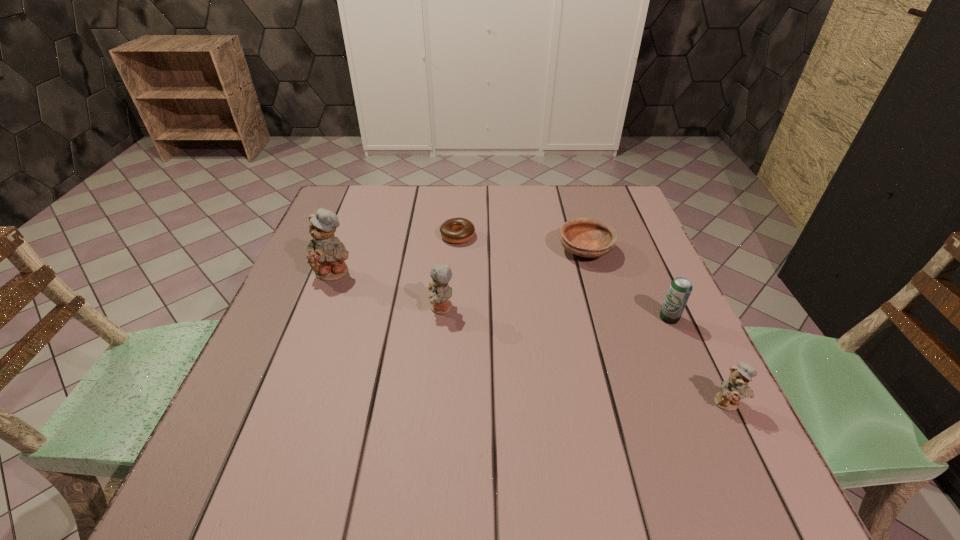
This screenshot has width=960, height=540. What are the coordinates of `object that is the fifth closest one to the tallest object` in the screenshot? It's located at (736, 387).

Locate an element on the screen. The height and width of the screenshot is (540, 960). teddy bear that is the third closest one to the shortest object is located at coordinates click(x=736, y=387).

Select which teddy bear is the third closest to the second shortest object. Please provide its 2D coordinates. Your answer should be formatted as a tuple, i.e. [(x, y)], where the tuple contains the x and y coordinates of a point satisfying the conditions above.

[(326, 256)]

Where is `free space that satisfies the following two spatial constraints: 1. on the front-facing side of the second farthest teddy bear; 2. on the back side of the beer can`? The width and height of the screenshot is (960, 540). free space that satisfies the following two spatial constraints: 1. on the front-facing side of the second farthest teddy bear; 2. on the back side of the beer can is located at coordinates (441, 318).

Identify the location of vacant space that satisfies the following two spatial constraints: 1. on the front side of the doughnut; 2. on the front-facing side of the second farthest teddy bear. This screenshot has width=960, height=540. (453, 308).

The image size is (960, 540). In order to click on vacant position in the image that satisfies the following two spatial constraints: 1. on the front-facing side of the leftmost object; 2. on the left side of the beer can in this screenshot , I will do `click(318, 318)`.